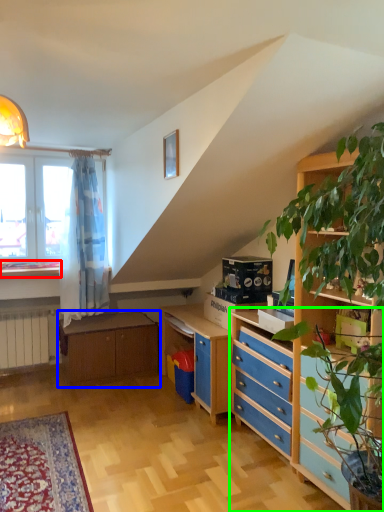
Question: Which object is the closest to the window sill (highlighted by a red box)? Choose among these: table (highlighted by a blue box) or chest of drawers (highlighted by a green box).

Choices:
 (A) table
 (B) chest of drawers

Answer: (A)